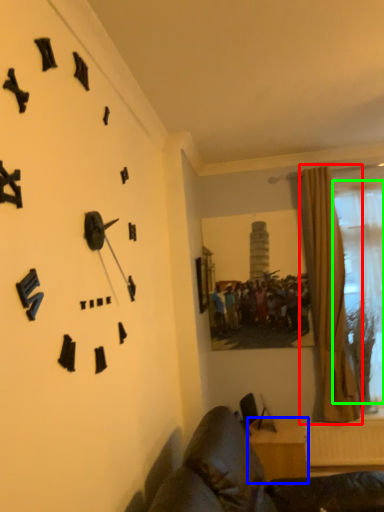
Question: Estimate the real-world distances between objects in this image. Which object is closer to curtain (highlighted by a red box), furniture (highlighted by a blue box) or bay window (highlighted by a green box)?

Choices:
 (A) furniture
 (B) bay window

Answer: (B)